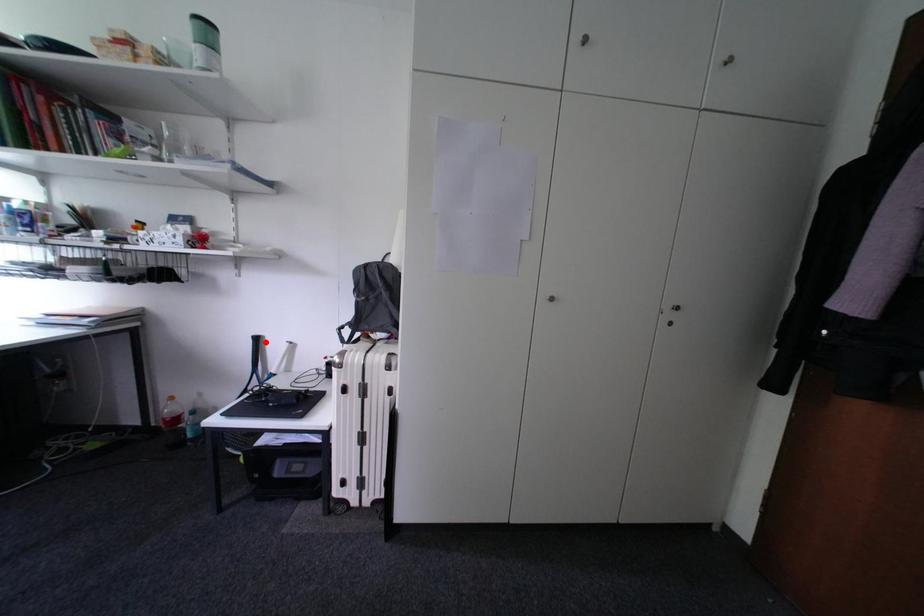
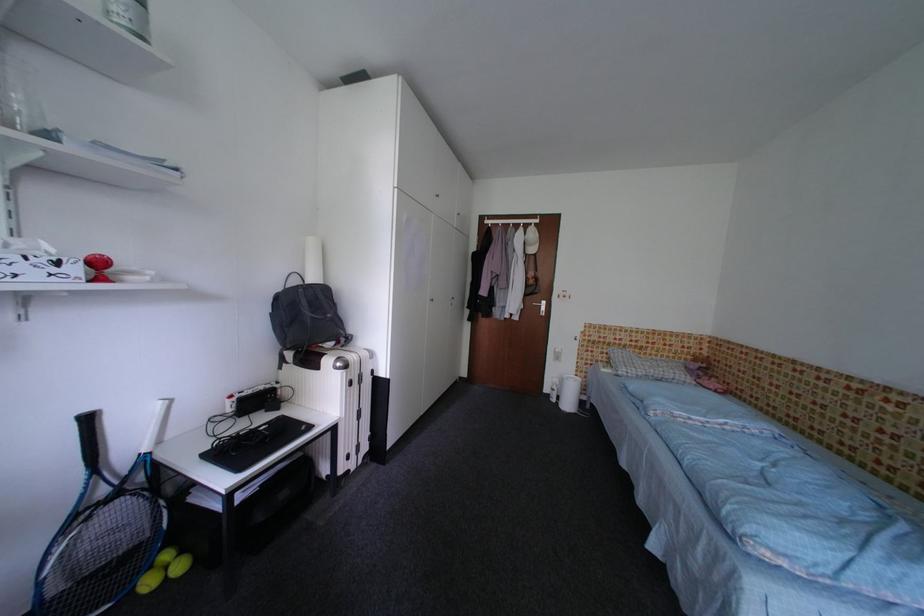
Locate, in the second image, the point that corresponds to the highlighted location in the first image.

(98, 422)